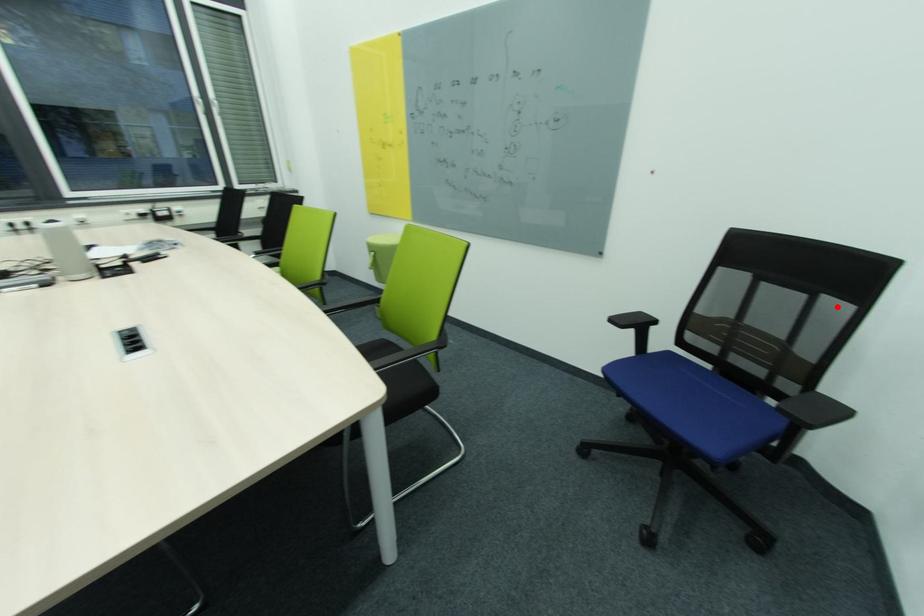
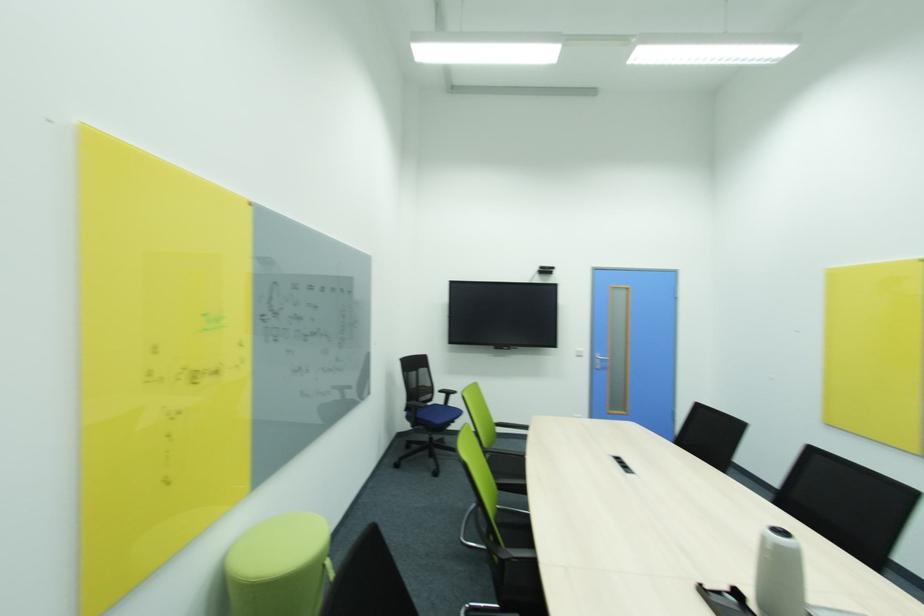
Locate, in the second image, the point that corresponds to the highlighted location in the first image.

(428, 371)